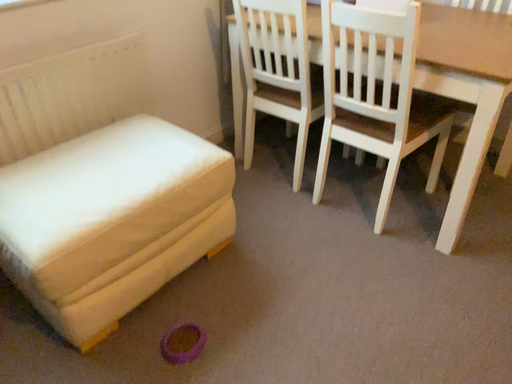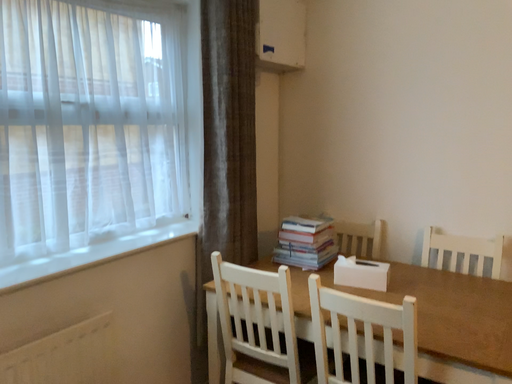
Question: How did the camera likely rotate when shooting the video?

Choices:
 (A) rotated upward
 (B) rotated downward

Answer: (A)